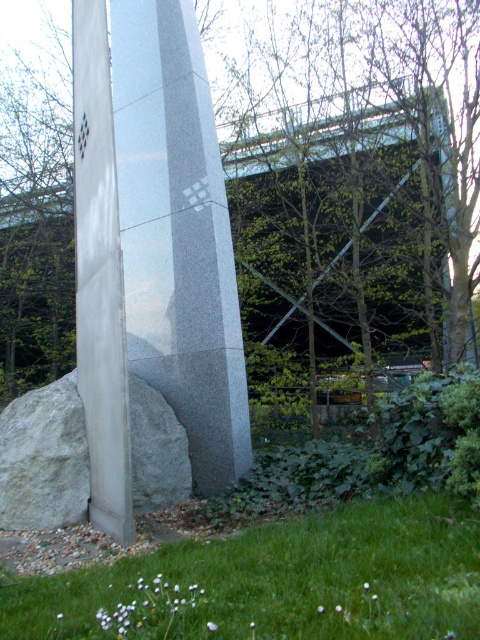
Is green leafy tree at center above green grass at lower center?

Yes.

Between green leafy tree at center and green grass at lower center, which one has less height?

green grass at lower center

Is point (228, 234) farther from camera compared to point (38, 621)?

That is True.

Identify the location of green leafy tree at center. Image resolution: width=480 pixels, height=640 pixels. (358, 177).

Which is in front, point (155, 12) or point (297, 564)?

Positioned in front is point (297, 564).

Can you confirm if white polished stone column at center is positioned above green grass at lower center?

Yes.

Identify the location of white polished stone column at center. This screenshot has height=640, width=480. (153, 244).

Does green grass at lower center have a lesser height compared to white marble rock at lower left?

Indeed, green grass at lower center has a lesser height compared to white marble rock at lower left.

Is green grass at lower center to the left of white marble rock at lower left from the viewer's perspective?

In fact, green grass at lower center is to the right of white marble rock at lower left.

What are the coordinates of `green grass at lower center` in the screenshot? It's located at (288, 579).

At what (x,y) coordinates should I click in order to perform the action: click on green grass at lower center. Please return your answer as a coordinate pair (x, y). This screenshot has width=480, height=640. Looking at the image, I should click on (288, 579).